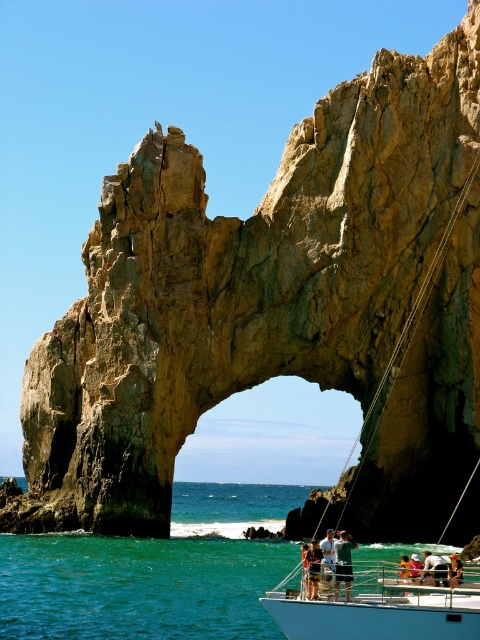
Question: Does metallic silver helmet at center come in front of wooden paddle at center?

Choices:
 (A) no
 (B) yes

Answer: (A)

Question: Can you confirm if white tennis racket at center is bigger than white fabric shirt at center?

Choices:
 (A) no
 (B) yes

Answer: (A)

Question: Is turquoise water at lower left smaller than white fabric shirt at center?

Choices:
 (A) yes
 (B) no

Answer: (B)

Question: Among these objects, which one is farthest from the camera?

Choices:
 (A) white glossy boat at lower right
 (B) metallic silver helmet at center
 (C) wooden paddle at center

Answer: (B)

Question: Considering the real-world distances, which object is closest to the metallic silver helmet at center?

Choices:
 (A) wooden paddle at center
 (B) turquoise water at lower left
 (C) white fabric shirt at center
 (D) matte black shorts at lower center

Answer: (A)

Question: Which of these objects is positioned farthest from the wooden paddle at center?

Choices:
 (A) white glossy boat at lower right
 (B) matte black shorts at lower center

Answer: (B)